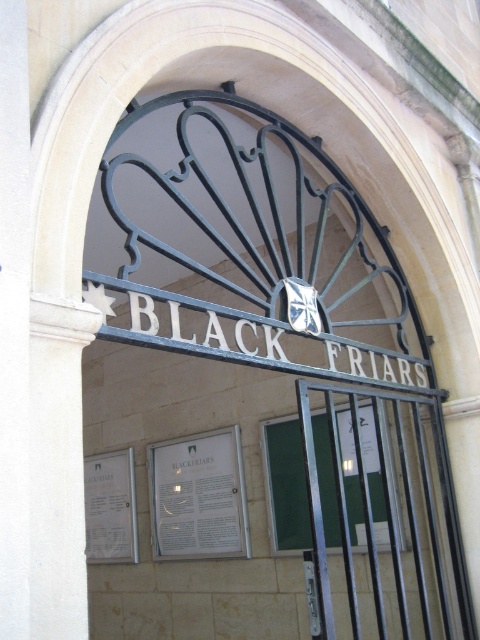
You are a delivery person standing at the entrance of Black Friars. You need to place a camera exactly 8 meters away from the white paper sign at center. Based on the scene description, can you determine if the camera will be placed beyond the entrance area or within it?

The white paper sign at center and camera are 7.94 meters apart, which is slightly less than 8 meters. Therefore, placing the camera exactly 8 meters away from the white paper sign at center would place it just beyond the entrance area.